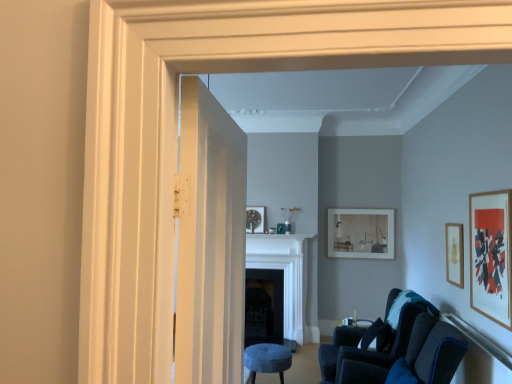
Question: Considering the relative positions of black matte fireplace at center, which ranks as the 1th fireplace in back-to-front order, and velvet dark blue chair at lower right in the image provided, is black matte fireplace at center, which ranks as the 1th fireplace in back-to-front order, behind velvet dark blue chair at lower right?

Choices:
 (A) no
 (B) yes

Answer: (B)

Question: Considering the relative sizes of black matte fireplace at center, which ranks as the 1th fireplace in back-to-front order, and velvet dark blue chair at lower right in the image provided, is black matte fireplace at center, which ranks as the 1th fireplace in back-to-front order, wider than velvet dark blue chair at lower right?

Choices:
 (A) yes
 (B) no

Answer: (B)

Question: Considering the relative sizes of black matte fireplace at center, which ranks as the 1th fireplace in back-to-front order, and velvet dark blue chair at lower right in the image provided, is black matte fireplace at center, which ranks as the 1th fireplace in back-to-front order, bigger than velvet dark blue chair at lower right?

Choices:
 (A) yes
 (B) no

Answer: (B)

Question: Can you confirm if black matte fireplace at center, which ranks as the 1th fireplace in back-to-front order, is shorter than velvet dark blue chair at lower right?

Choices:
 (A) yes
 (B) no

Answer: (A)

Question: Is black matte fireplace at center, placed as the second fireplace when sorted from front to back, facing away from velvet dark blue chair at lower right?

Choices:
 (A) no
 (B) yes

Answer: (A)

Question: Does black matte fireplace at center, which ranks as the 1th fireplace in back-to-front order, lie in front of velvet dark blue chair at lower right?

Choices:
 (A) yes
 (B) no

Answer: (B)

Question: Does wooden picture frame at right, which is the second picture frame from back to front, turn towards matte white picture frame at center-right, marked as the first picture frame in a back-to-front arrangement?

Choices:
 (A) yes
 (B) no

Answer: (B)

Question: Is matte white picture frame at center-right, marked as the first picture frame in a back-to-front arrangement, inside wooden picture frame at right, the 2th picture frame when ordered from front to back?

Choices:
 (A) no
 (B) yes

Answer: (A)

Question: Is wooden picture frame at right, which is the second picture frame from back to front, placed right next to matte white picture frame at center-right, marked as the first picture frame in a back-to-front arrangement?

Choices:
 (A) no
 (B) yes

Answer: (A)

Question: From the image's perspective, is wooden picture frame at right, which is the second picture frame from back to front, located above matte white picture frame at center-right, marked as the first picture frame in a back-to-front arrangement?

Choices:
 (A) no
 (B) yes

Answer: (B)

Question: Can you confirm if wooden picture frame at right, the 2th picture frame when ordered from front to back, is positioned to the right of matte white picture frame at center-right, marked as the first picture frame in a back-to-front arrangement?

Choices:
 (A) no
 (B) yes

Answer: (B)

Question: Considering the relative sizes of wooden picture frame at right, which is the second picture frame from back to front, and matte white picture frame at center-right, which appears as the 3th picture frame when viewed from the front, in the image provided, is wooden picture frame at right, which is the second picture frame from back to front, smaller than matte white picture frame at center-right, which appears as the 3th picture frame when viewed from the front,?

Choices:
 (A) yes
 (B) no

Answer: (A)

Question: Can you confirm if black matte fireplace at center, placed as the second fireplace when sorted from front to back, is bigger than wooden picture frame at right, which is the second picture frame from back to front?

Choices:
 (A) no
 (B) yes

Answer: (B)